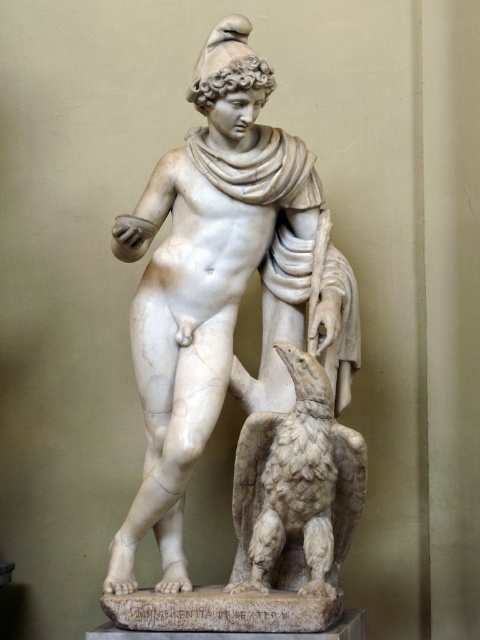
What are the coordinates of the white marble statue at center in the image?

The coordinates of the white marble statue at center are at point (212, 284).